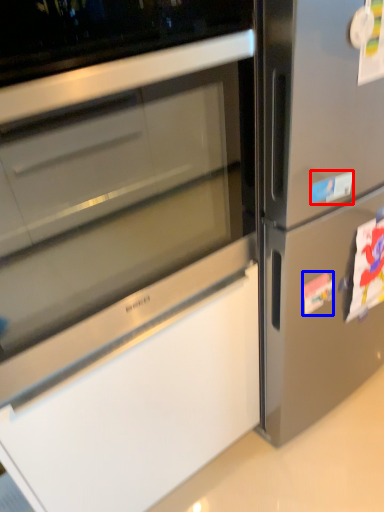
Question: Which object is further to the camera taking this photo, sticker (highlighted by a red box) or sticker (highlighted by a blue box)?

Choices:
 (A) sticker
 (B) sticker

Answer: (B)